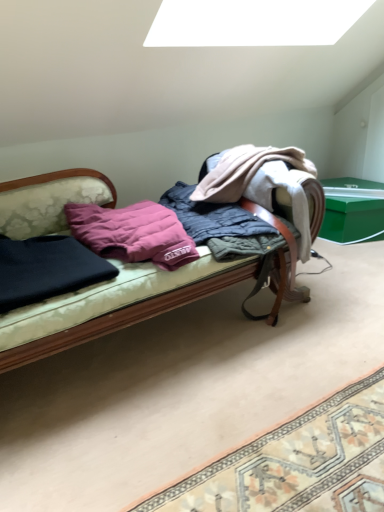
Locate an element on the screen. The height and width of the screenshot is (512, 384). vacant space that is to the left of patterned fabric mat at lower right is located at coordinates (151, 441).